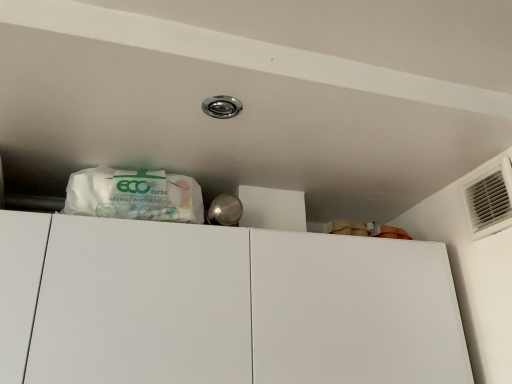
Describe the element at coordinates (489, 197) in the screenshot. I see `white plastic air conditioning at upper right` at that location.

I want to click on white plastic air conditioning at upper right, so click(x=489, y=197).

Measure the distance between point (511, 218) and camera.

The depth of point (511, 218) is 37.28 inches.

This screenshot has height=384, width=512. I want to click on white plastic air conditioning at upper right, so click(489, 197).